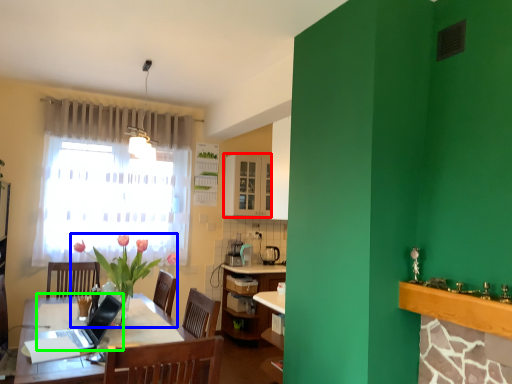
Question: Based on their relative distances, which object is nearer to cabinetry (highlighted by a red box)? Choose from houseplant (highlighted by a blue box) and laptop (highlighted by a green box).

Choices:
 (A) houseplant
 (B) laptop

Answer: (A)